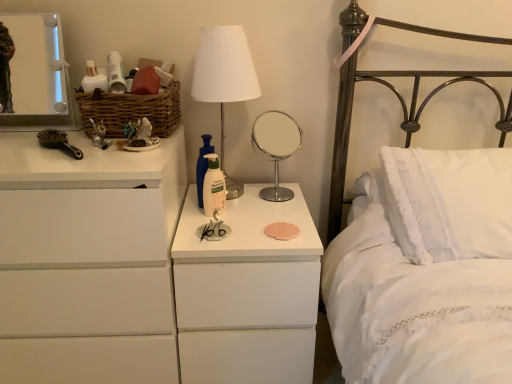
You are a GUI agent. You are given a task and a screenshot of the screen. Output one action in this format:
    pyautogui.click(x=<x>, y=<y>)
    Task: Click on the vacant space in front of white matte lotion at center
    This screenshot has width=512, height=384.
    Given the screenshot: What is the action you would take?
    pos(217,241)